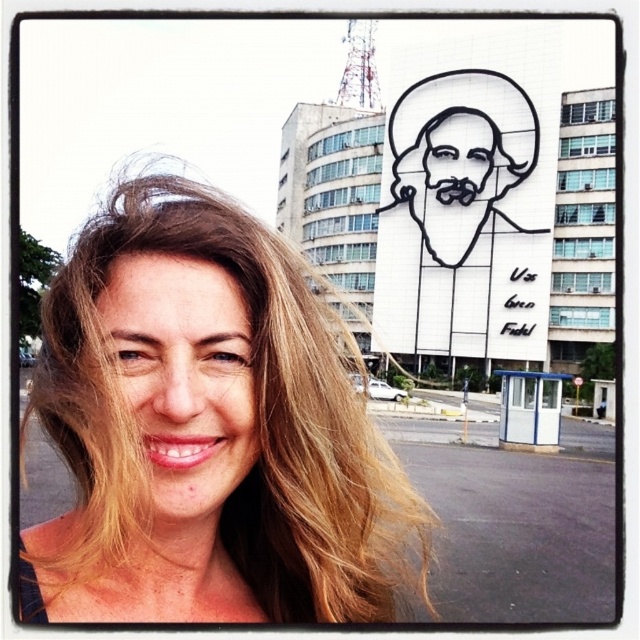
Which is above, blonde hair at center or black outline face at upper center?

black outline face at upper center is above.

Does blonde hair at center come in front of black outline face at upper center?

Yes, it is in front of black outline face at upper center.

At what (x,y) coordinates should I click in order to perform the action: click on blonde hair at center. Please return your answer as a coordinate pair (x, y). Image resolution: width=640 pixels, height=640 pixels. Looking at the image, I should click on (208, 432).

You are a GUI agent. You are given a task and a screenshot of the screen. Output one action in this format:
    pyautogui.click(x=<x>, y=<y>)
    Task: Click on the blonde hair at center
    The image size is (640, 640).
    Given the screenshot: What is the action you would take?
    pyautogui.click(x=208, y=432)

Which is behind, point (476, 198) or point (182, 272)?

Point (476, 198)

Describe the element at coordinates (452, 204) in the screenshot. I see `black outline mural at upper center` at that location.

The width and height of the screenshot is (640, 640). What are the coordinates of `black outline mural at upper center` in the screenshot? It's located at (452, 204).

Does blonde hair at center appear under smooth skin face at center?

Yes, blonde hair at center is below smooth skin face at center.

Which is behind, point (157, 396) or point (227, 468)?

Point (227, 468)

Identify the location of blonde hair at center. (208, 432).